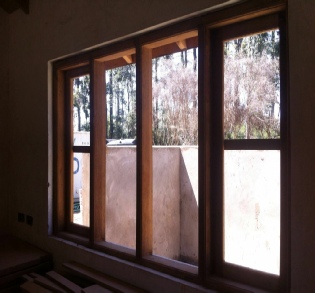
At what (x,y) coordinates should I click in order to perform the action: click on handle. Please return your answer as a coordinate pair (x, y). Looking at the image, I should click on [x=77, y=162].